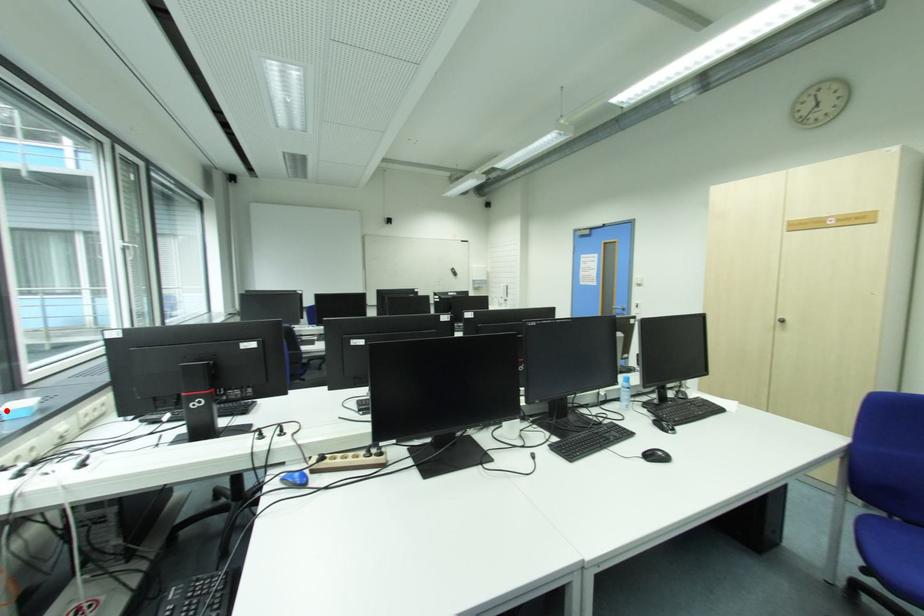
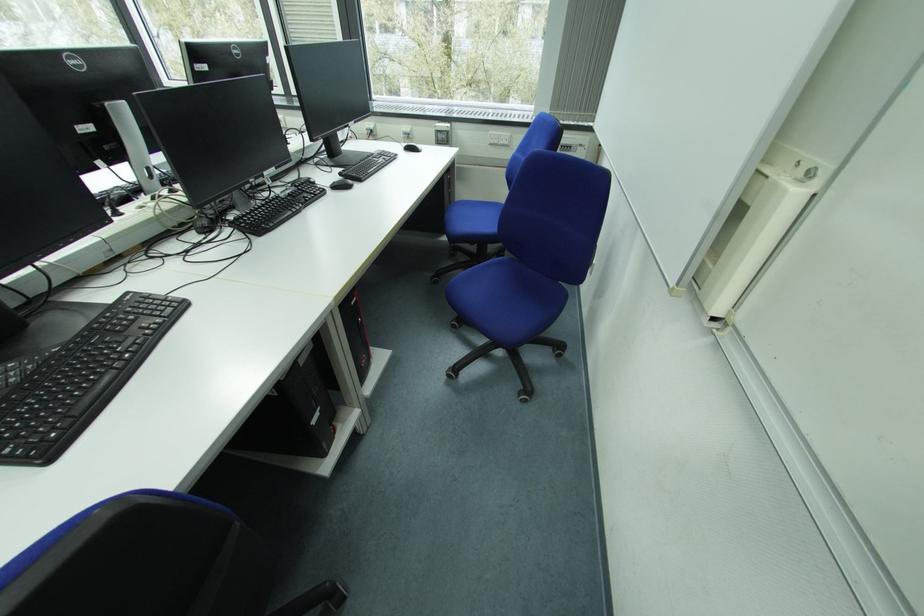
Question: I am providing you with two images of the same scene from different viewpoints. A red point is marked on the first image. Can you still see the location of the red point in image 2?

Choices:
 (A) Yes
 (B) No

Answer: (B)